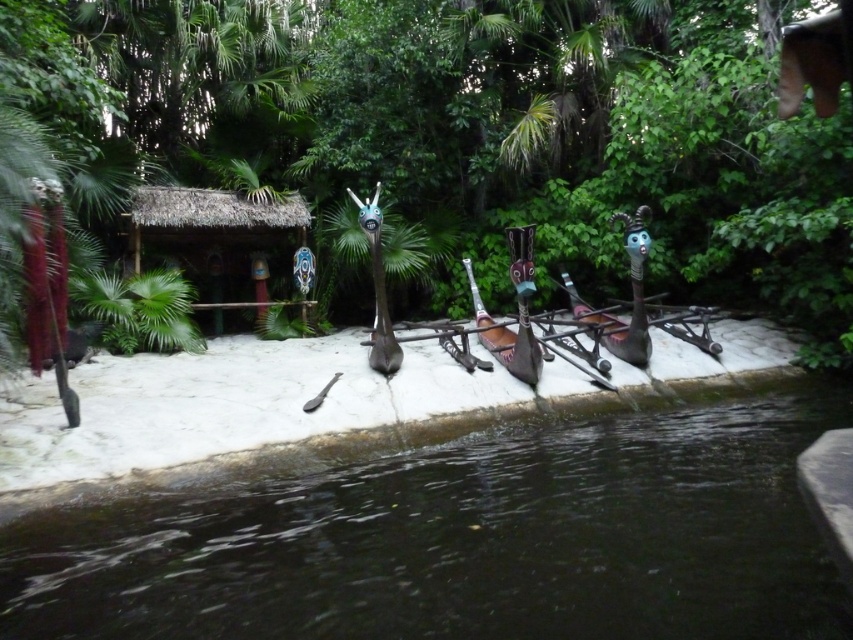
From the picture: You are planning to build a small boat dock on the bank near the dark water at lower center and the thatched straw hut at center. Since the dock needs to be as wide as the wider of the two, which object should you use to determine the dock width?

The thatched straw hut at center is wider than the dark water at lower center, so you should use the thatched straw hut at center to determine the dock width.

You are planning to place a small wooden bench in this tropical scene. The bench requires 2 meters of space. Given the green leafy vegetation at center and the dark water at lower center, which area would allow the bench to fit comfortably without overcrowding?

The green leafy vegetation at center has a greater width than the dark water at lower center, so placing the bench there would provide enough space for it to fit comfortably without overcrowding.